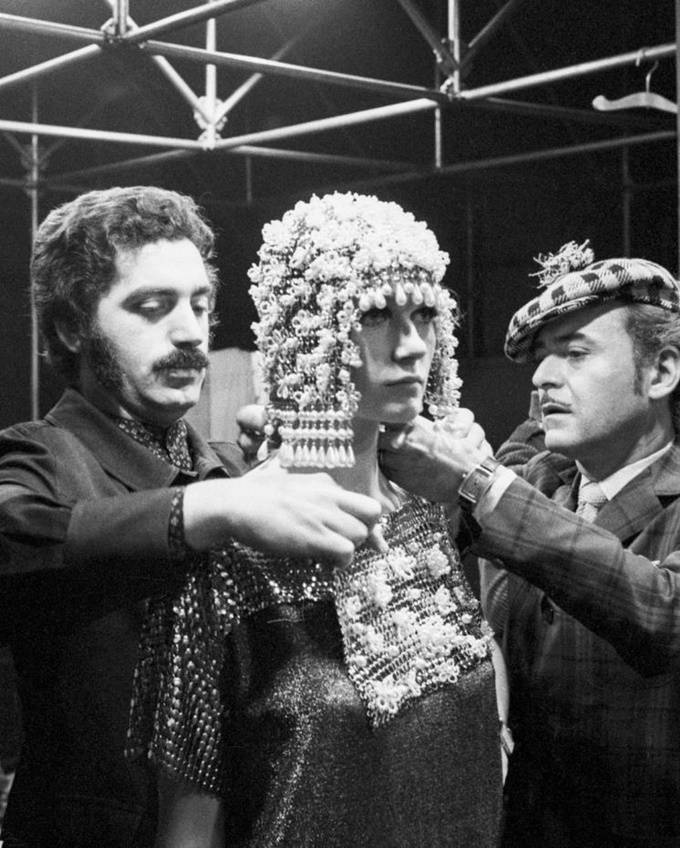
Locate an element on the screen. This screenshot has height=848, width=680. hanger is located at coordinates (646, 107).